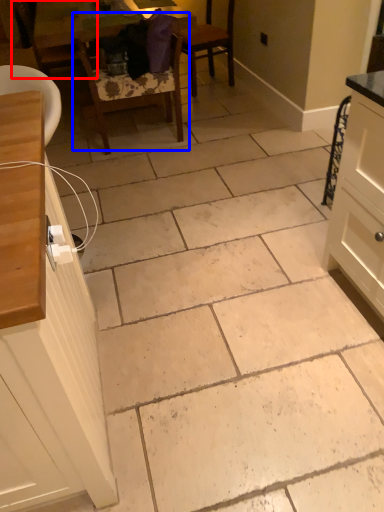
Question: Which object is further to the camera taking this photo, chair (highlighted by a red box) or chair (highlighted by a blue box)?

Choices:
 (A) chair
 (B) chair

Answer: (A)